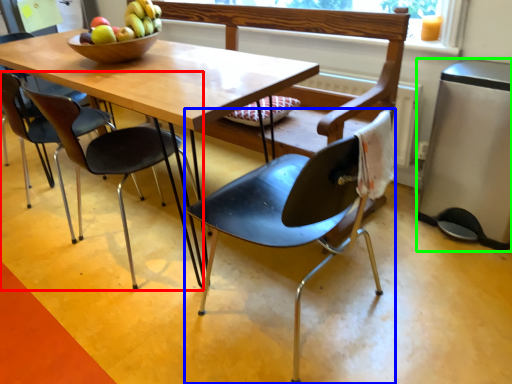
Question: Estimate the real-world distances between objects in this image. Which object is farther from chair (highlighted by a red box), chair (highlighted by a blue box) or appliance (highlighted by a green box)?

Choices:
 (A) chair
 (B) appliance

Answer: (B)